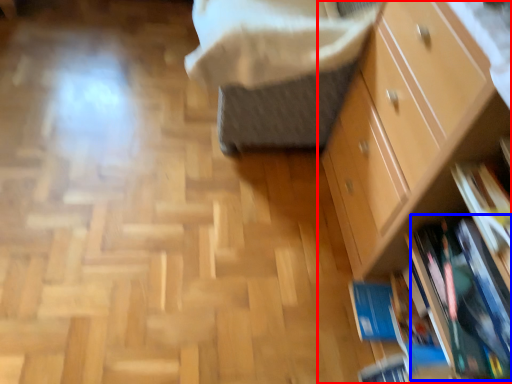
Question: Which point is closer to the camera, chest of drawers (highlighted by a red box) or book (highlighted by a blue box)?

Choices:
 (A) chest of drawers
 (B) book

Answer: (A)